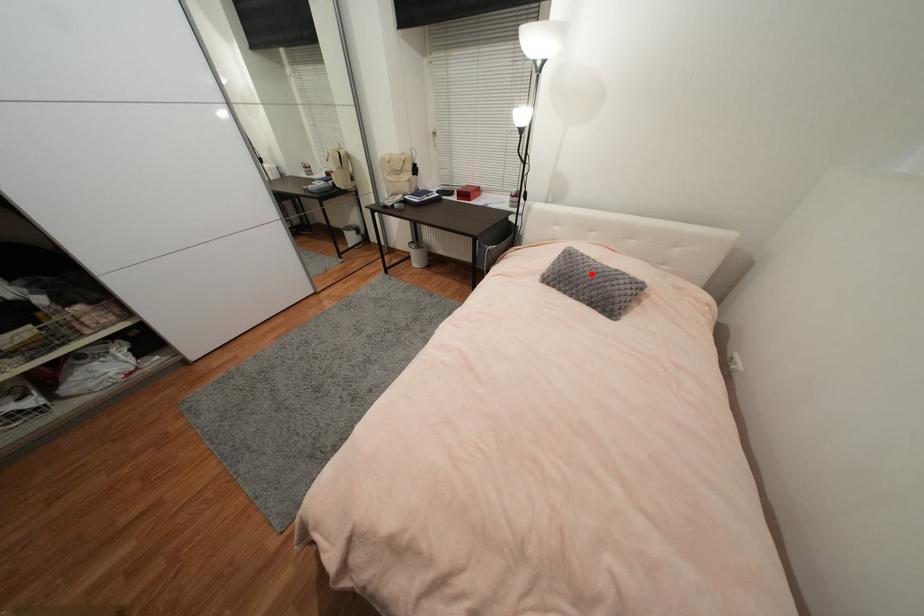
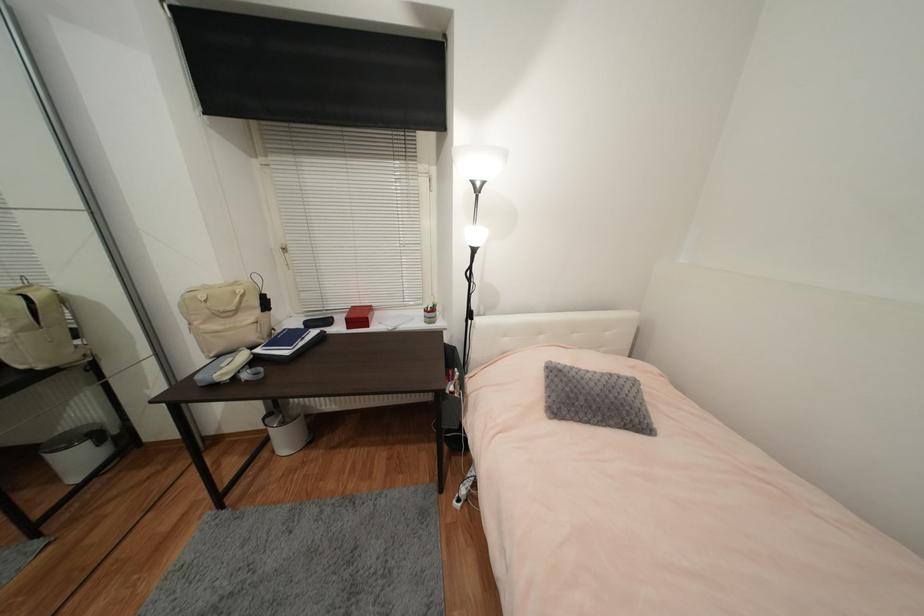
Question: I am providing you with two images of the same scene from different viewpoints. A red point is shown in image1. For the corresponding object point in image2, is it positioned nearer or farther from the camera?

Choices:
 (A) Nearer
 (B) Farther

Answer: (B)